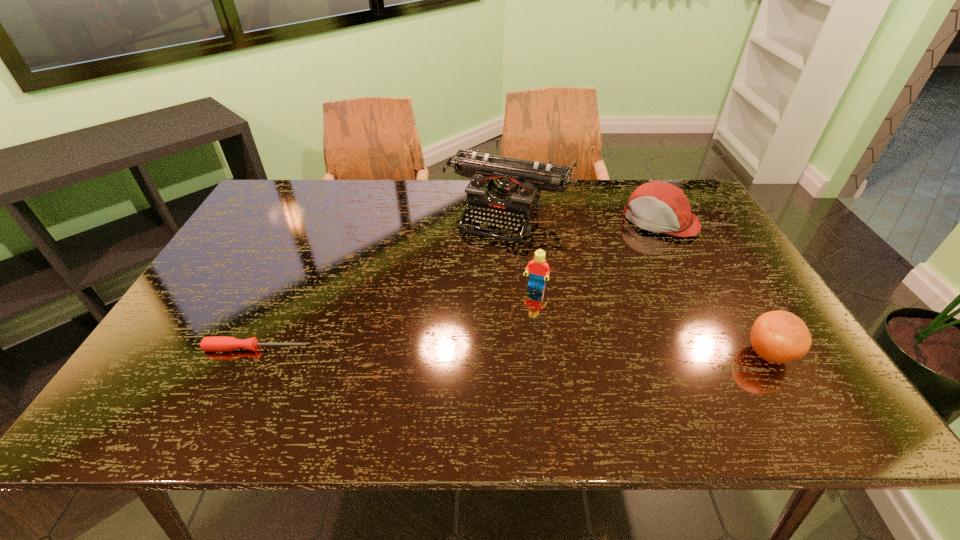
You are a GUI agent. You are given a task and a screenshot of the screen. Output one action in this format:
    pyautogui.click(x=<x>, y=<y>)
    Task: Click on the vacant space at the far left corner of the desktop
    
    Given the screenshot: What is the action you would take?
    pyautogui.click(x=306, y=198)

Where is `vacant area at the near right corner of the desktop`? The height and width of the screenshot is (540, 960). vacant area at the near right corner of the desktop is located at coordinates (755, 352).

Where is `free point between the orange and the shortest object`? This screenshot has height=540, width=960. free point between the orange and the shortest object is located at coordinates (513, 351).

This screenshot has width=960, height=540. I want to click on empty space that is in between the leftmost object and the third nearest object, so click(396, 318).

At what (x,y) coordinates should I click in order to perform the action: click on vacant space in between the typewriter and the orange. Please return your answer as a coordinate pair (x, y). This screenshot has height=540, width=960. Looking at the image, I should click on (637, 284).

In order to click on vacant region between the screwdriver and the cap in this screenshot , I will do `click(458, 285)`.

Locate an element on the screen. free space that is in between the screwdriver and the cap is located at coordinates (458, 285).

You are a GUI agent. You are given a task and a screenshot of the screen. Output one action in this format:
    pyautogui.click(x=<x>, y=<y>)
    Task: Click on the vacant space that's between the orange and the shortest object
    The image size is (960, 540).
    Given the screenshot: What is the action you would take?
    pyautogui.click(x=513, y=351)

Where is `vacant area that lies between the leftmost object and the third farthest object`? The image size is (960, 540). vacant area that lies between the leftmost object and the third farthest object is located at coordinates (396, 318).

Identify the location of free area in between the Lego and the screwdriver. (396, 318).